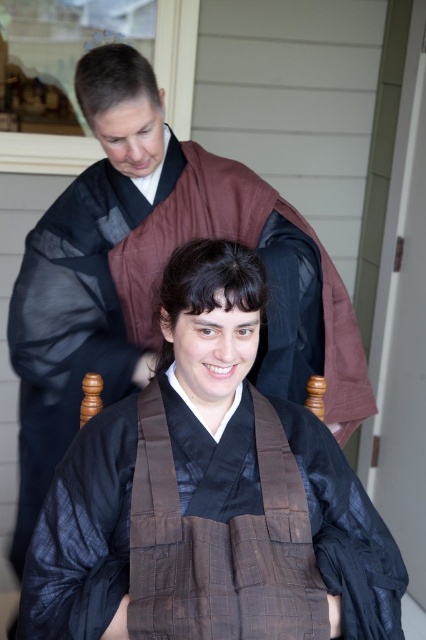
You are an assistant helping to organize a cultural event. You need to place a decorative item at point (209, 529). According to the scene, what object is located at that point?

The brown quilted fabric robe at center is located at point (209, 529).

You are a costume designer preparing for a cultural performance. You need to ensure that the brown quilted fabric robe at center and the brown silk kimono at center are displayed properly. Based on their sizes, which one should be placed on a taller stand to avoid looking disproportionate?

The brown silk kimono at center should be placed on a taller stand because it has a greater height than the brown quilted fabric robe at center.

You are a photographer trying to capture both the brown quilted fabric robe at center and the brown silk kimono at center in a single shot. Since you want both to be clearly visible, which robe should you focus on first to ensure sharpness?

You should focus on the brown quilted fabric robe at center first because it is closer to the viewer than the brown silk kimono at center, so adjusting focus starting from the closer object ensures both will be in focus.